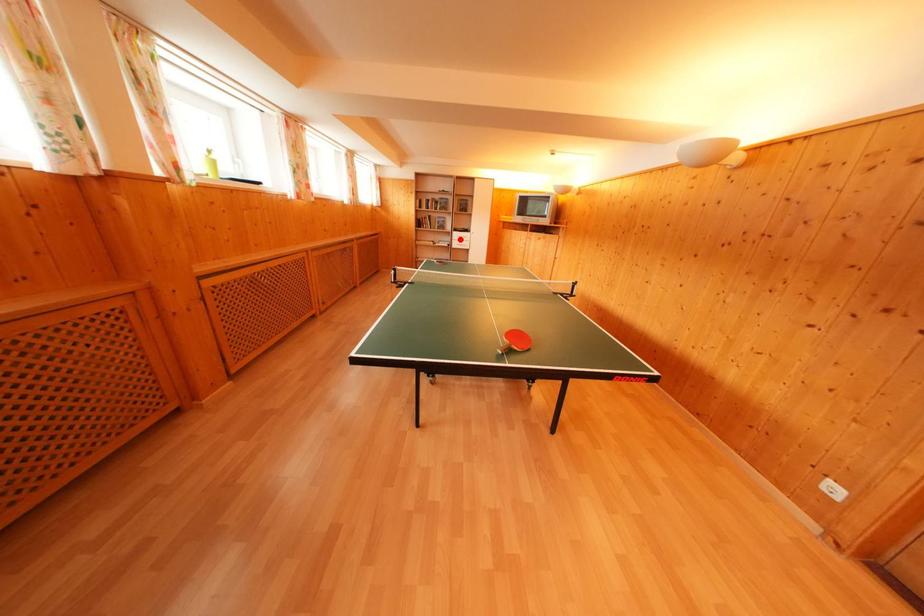
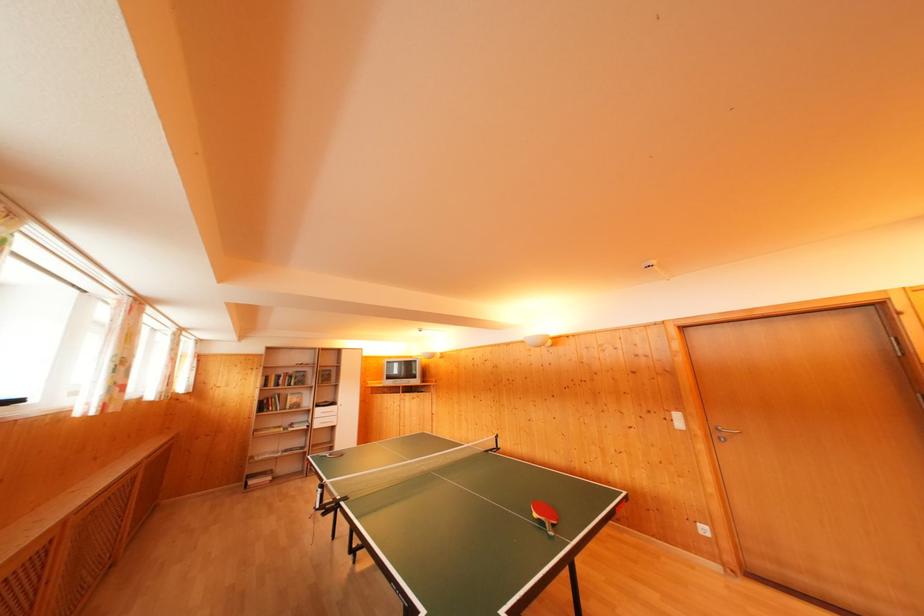
The point at the highlighted location is marked in the first image. Where is the corresponding point in the second image?

(322, 416)